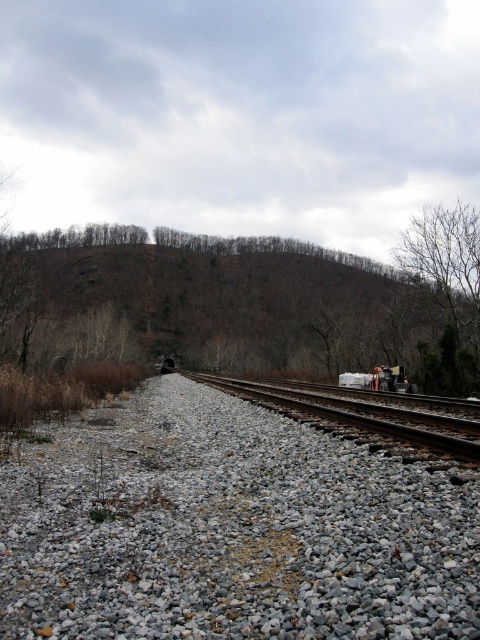
You are a train engineer approaching the railway scene. You notice the bare rock hillside at center and the smooth metal train track at center. Which object would appear larger in your view as you get closer to them?

The bare rock hillside at center would appear larger in your view as you get closer because it is much taller than the smooth metal train track at center.

You are a railway inspector checking the track conditions. You notice the gray gravel at center and the bare branches at right. Which of these two items has smaller particles or parts?

The gray gravel at center has smaller size compared to the bare branches at right, so the gray gravel at center has smaller particles.